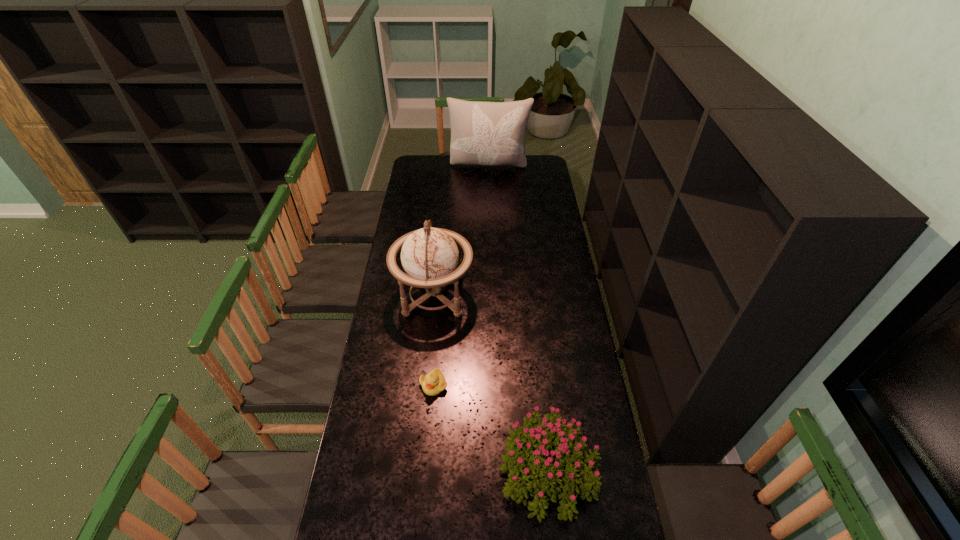
Locate an element on the screen. object present at the far edge is located at coordinates (482, 133).

You are a GUI agent. You are given a task and a screenshot of the screen. Output one action in this format:
    pyautogui.click(x=<x>, y=<y>)
    Task: Click on the object at the left edge
    
    Given the screenshot: What is the action you would take?
    pyautogui.click(x=430, y=257)

Locate an element on the screen. Image resolution: width=960 pixels, height=540 pixels. cushion positioned at the right edge is located at coordinates (482, 133).

Where is `bouquet at the right edge`? This screenshot has width=960, height=540. bouquet at the right edge is located at coordinates (526, 443).

Locate an element on the screen. Image resolution: width=960 pixels, height=540 pixels. object situated at the far right corner is located at coordinates (482, 133).

Where is `vacant region at the left edge of the desktop`? The image size is (960, 540). vacant region at the left edge of the desktop is located at coordinates (420, 212).

The width and height of the screenshot is (960, 540). In order to click on blank space at the right edge of the desktop in this screenshot , I will do (x=546, y=310).

The width and height of the screenshot is (960, 540). Identify the location of vacant point located between the second farthest object and the duckling. coord(434,340).

The width and height of the screenshot is (960, 540). Find the location of `vacant area that lies between the nearest object and the third nearest object`. vacant area that lies between the nearest object and the third nearest object is located at coordinates (492, 384).

This screenshot has height=540, width=960. I want to click on free space between the cushion and the second farthest object, so click(x=462, y=231).